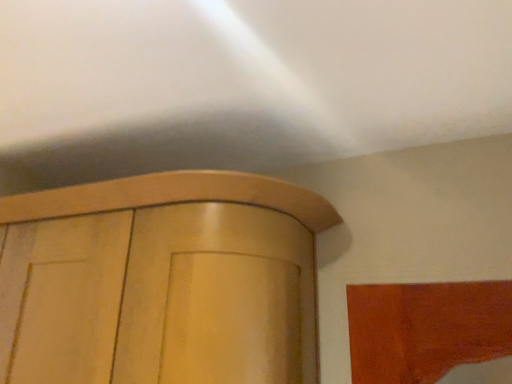
Measure the distance between point (271, 244) and camera.

Point (271, 244) is 35.51 inches away from camera.

This screenshot has height=384, width=512. Find the location of `light wood cupboard at center`. light wood cupboard at center is located at coordinates (161, 281).

What do you see at coordinates (161, 281) in the screenshot?
I see `light wood cupboard at center` at bounding box center [161, 281].

Measure the distance between light wood cupboard at center and camera.

A distance of 30.49 inches exists between light wood cupboard at center and camera.

In order to face light wood cupboard at center, should I rotate leftwards or rightwards?

It's best to rotate left around 21.690 degrees.

What is the approximate width of light wood cupboard at center?

The width of light wood cupboard at center is 16.63 inches.

Identify the location of light wood cupboard at center. (161, 281).